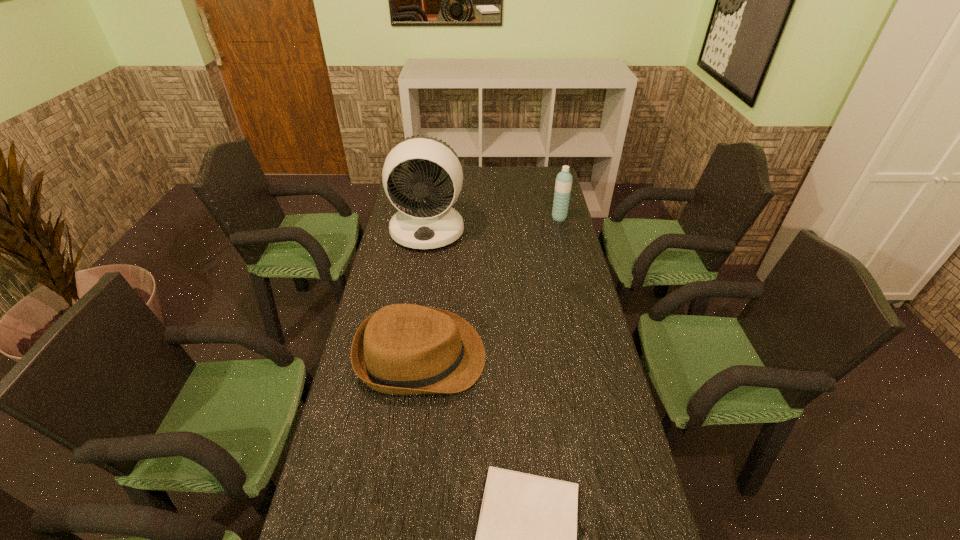
What are the coordinates of `object that can be found as the second closest to the fan` in the screenshot? It's located at (563, 185).